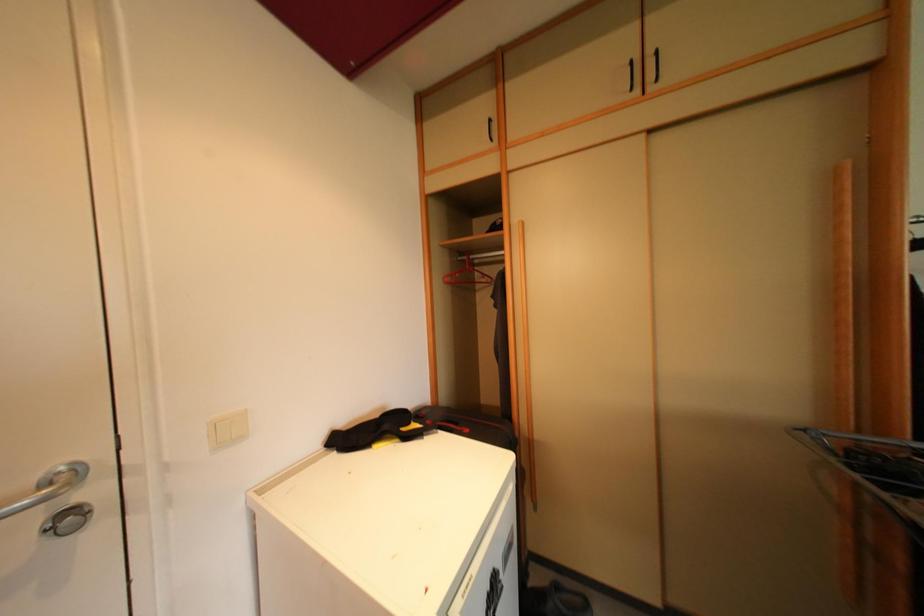
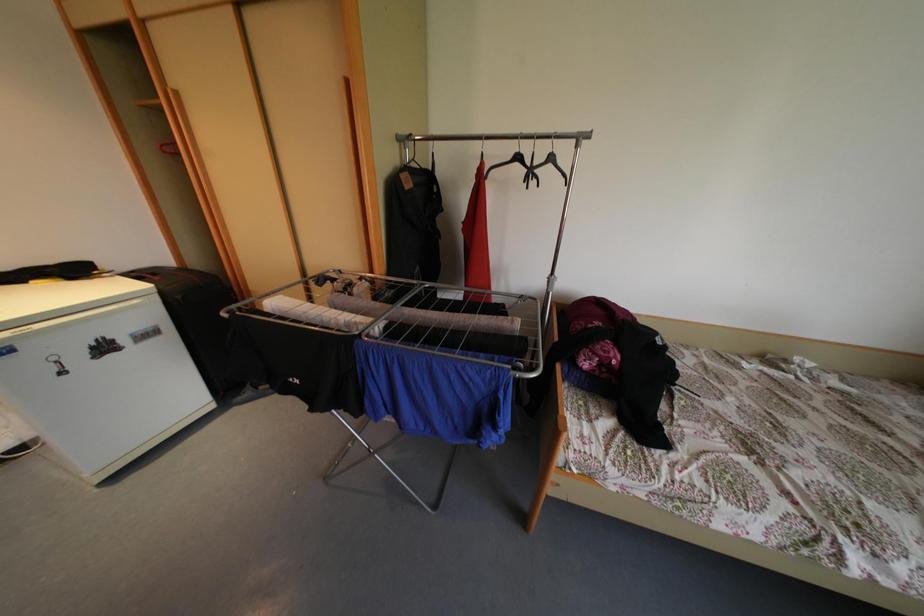
Looking at this image, in a continuous first-person perspective shot, in which direction is the camera moving?

The cameraman moved toward right, backward.